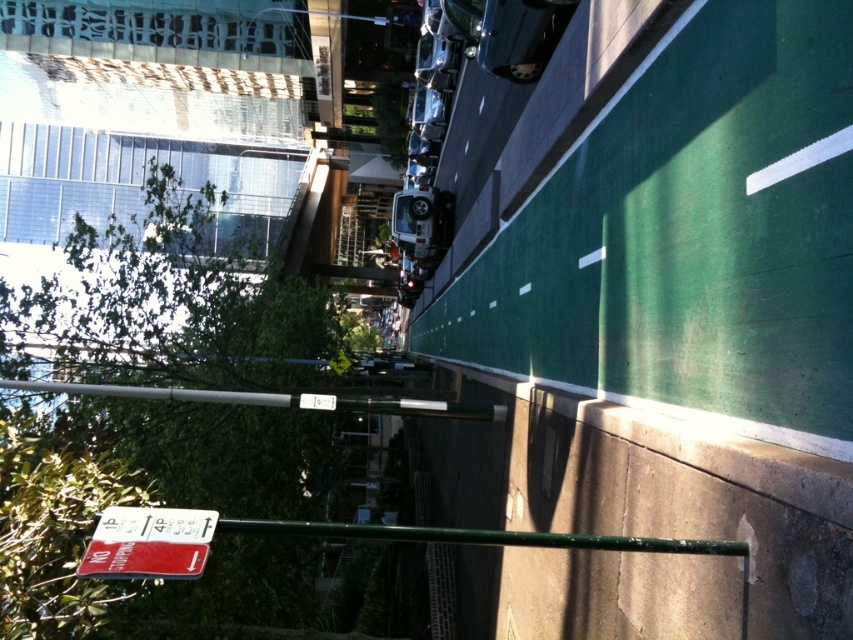
Describe the element at coordinates (161, 394) in the screenshot. I see `silver metallic pole at center` at that location.

Who is taller, silver metallic pole at center or metallic silver train at center?

metallic silver train at center

Is point (280, 404) positioned in front of point (421, 204)?

Yes, it is in front of point (421, 204).

Identify the location of silver metallic pole at center. The height and width of the screenshot is (640, 853). (161, 394).